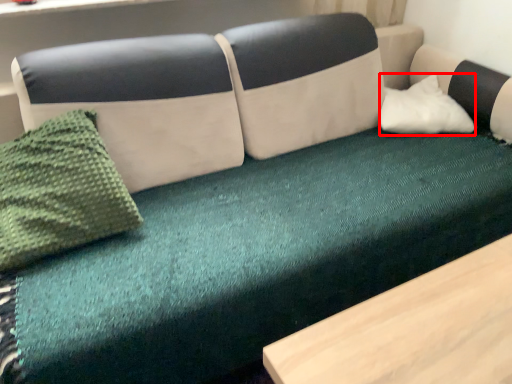
Question: Considering the relative positions of pillow (annotated by the red box) and throw pillow in the image provided, where is pillow (annotated by the red box) located with respect to the staircase?

Choices:
 (A) right
 (B) left

Answer: (A)